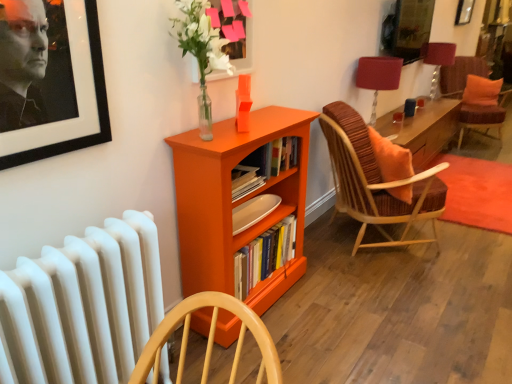
I want to click on free spot to the right of wooden woven chair with orange cushion at right, the second chair when ordered from right to left, so click(x=473, y=251).